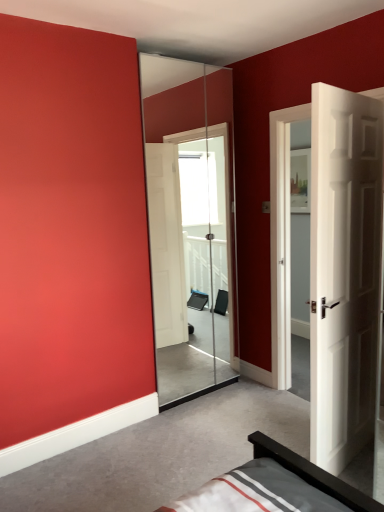
This screenshot has width=384, height=512. I want to click on vacant space underneath transparent glass screen door at center (from a real-world perspective), so click(210, 392).